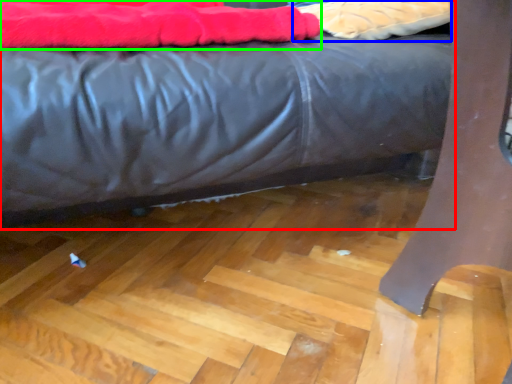
Question: Based on their relative distances, which object is farther from bed (highlighted by a red box)? Choose from material (highlighted by a blue box) and blanket (highlighted by a green box).

Choices:
 (A) material
 (B) blanket

Answer: (A)